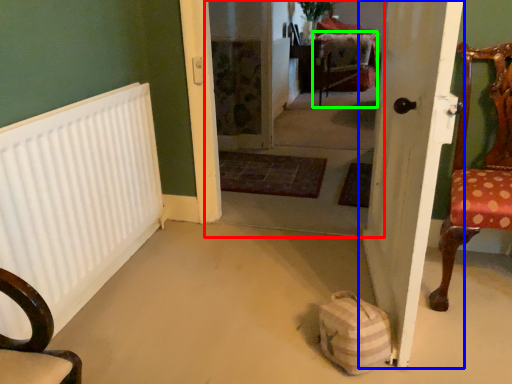
Question: Based on their relative distances, which object is farther from corridor (highlighted by a red box)? Choose from door (highlighted by a blue box) and armchair (highlighted by a green box).

Choices:
 (A) door
 (B) armchair

Answer: (A)